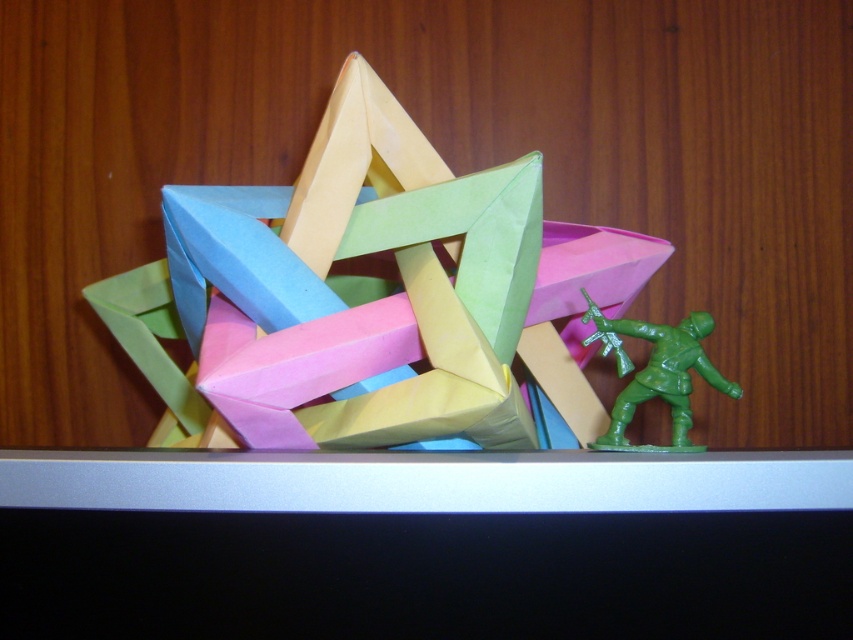
Question: Is pastel paper star at center above green plastic toy soldier at lower right?

Choices:
 (A) yes
 (B) no

Answer: (A)

Question: Which point is farther to the camera?

Choices:
 (A) (138, 358)
 (B) (646, 339)

Answer: (A)

Question: Which object appears farthest from the camera in this image?

Choices:
 (A) green plastic toy soldier at lower right
 (B) pastel paper star at center

Answer: (A)

Question: Observing the image, what is the correct spatial positioning of pastel paper star at center in reference to green plastic toy soldier at lower right?

Choices:
 (A) below
 (B) above

Answer: (B)

Question: Does pastel paper star at center have a greater width compared to green plastic toy soldier at lower right?

Choices:
 (A) no
 (B) yes

Answer: (B)